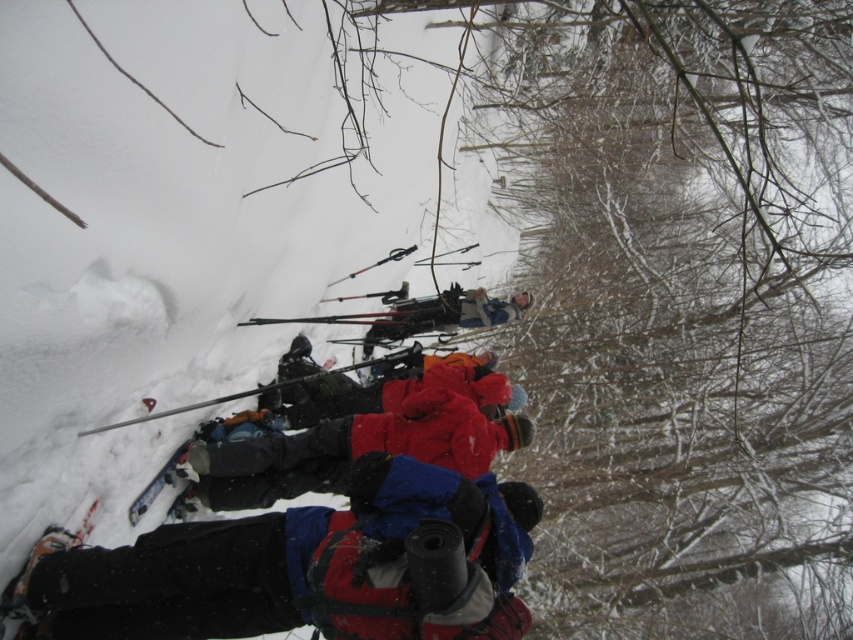
You are standing in the snowy forest scene and want to move from the point at coordinates point (270,493) to the point at coordinates point (4,592). Which direction should you move to get closer to the second point?

Since point (270,493) is further to the camera than point (4,592), you should move forward towards the direction of the second point to get closer.

You are trying to decide which jacket to wear for a cold winter day. You have both the red fleece jacket at center and the red fuzzy jacket at center. Based on the image, which one appears to be more spacious in the torso area?

The red fleece jacket at center appears to be more spacious in the torso area as it might be wider than the red fuzzy jacket at center according to the image description.